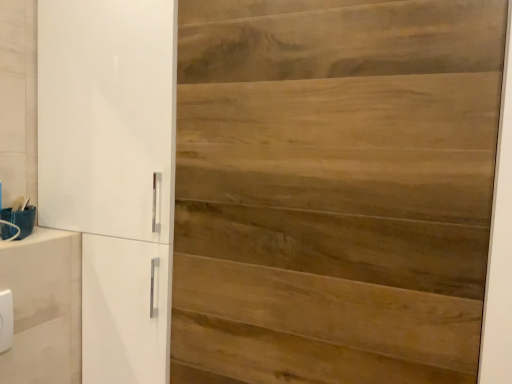
Locate an element on the screen. The height and width of the screenshot is (384, 512). wooden door at center is located at coordinates (333, 189).

What are the coordinates of `wooden door at center` in the screenshot? It's located at (333, 189).

Considering the positions of objects white plastic/light switch at lower left and white glossy cupboard at left in the image provided, who is more to the left, white plastic/light switch at lower left or white glossy cupboard at left?

Positioned to the left is white plastic/light switch at lower left.

Is white plastic/light switch at lower left positioned with its back to white glossy cupboard at left?

No, white plastic/light switch at lower left's orientation is not away from white glossy cupboard at left.

From a real-world perspective, who is located higher, white plastic/light switch at lower left or white glossy cupboard at left?

white glossy cupboard at left.

From the image's perspective, who appears lower, white glossy cupboard at left or wooden door at center?

wooden door at center is shown below in the image.

Is white glossy cupboard at left to the left of wooden door at center from the viewer's perspective?

Yes.

Which object is wider, white glossy cupboard at left or wooden door at center?

Wider between the two is white glossy cupboard at left.

Considering the positions of objects white plastic/light switch at lower left and wooden door at center in the image provided, who is behind, white plastic/light switch at lower left or wooden door at center?

white plastic/light switch at lower left.

Is point (11, 308) closer or farther from the camera than point (426, 250)?

Clearly, point (11, 308) is more distant from the camera than point (426, 250).

Identify the location of door lying in front of the white glossy cupboard at left. (333, 189).

Between wooden door at center and white glossy cupboard at left, which one has larger width?

With larger width is white glossy cupboard at left.

Looking at this image, from a real-world perspective, is wooden door at center positioned over white glossy cupboard at left based on gravity?

Yes, from a real-world perspective, wooden door at center is over white glossy cupboard at left

Is wooden door at center taller or shorter than white glossy cupboard at left?

wooden door at center is shorter than white glossy cupboard at left.

Considering the relative sizes of wooden door at center and white plastic/light switch at lower left in the image provided, is wooden door at center wider than white plastic/light switch at lower left?

No, wooden door at center is not wider than white plastic/light switch at lower left.

Does wooden door at center turn towards white plastic/light switch at lower left?

No, wooden door at center is not facing towards white plastic/light switch at lower left.

Can you tell me how much wooden door at center and white plastic/light switch at lower left differ in facing direction?

89.8 degrees.

This screenshot has width=512, height=384. In order to click on door that is on the right side of white plastic/light switch at lower left in this screenshot , I will do `click(333, 189)`.

Is white glossy cupboard at left not within white plastic/light switch at lower left?

Absolutely, white glossy cupboard at left is external to white plastic/light switch at lower left.

I want to click on light switch that appears in front of the white glossy cupboard at left, so click(6, 320).

Is white glossy cupboard at left aimed at white plastic/light switch at lower left?

Yes, white glossy cupboard at left is aimed at white plastic/light switch at lower left.

From the image's perspective, is white glossy cupboard at left on white plastic/light switch at lower left?

Yes, from the image's perspective, white glossy cupboard at left is above white plastic/light switch at lower left.

At what (x,y) coordinates should I click in order to perform the action: click on light switch directly beneath the white glossy cupboard at left (from a real-world perspective). Please return your answer as a coordinate pair (x, y). Looking at the image, I should click on (6, 320).

You are a GUI agent. You are given a task and a screenshot of the screen. Output one action in this format:
    pyautogui.click(x=<x>, y=<y>)
    Task: Click on the door that is on the right side of white glossy cupboard at left
    Image resolution: width=512 pixels, height=384 pixels.
    Given the screenshot: What is the action you would take?
    pyautogui.click(x=333, y=189)

Based on their spatial positions, is white plastic/light switch at lower left or wooden door at center closer to white glossy cupboard at left?

The object closer to white glossy cupboard at left is wooden door at center.

When comparing their distances from white plastic/light switch at lower left, does white glossy cupboard at left or wooden door at center seem closer?

The object closer to white plastic/light switch at lower left is white glossy cupboard at left.

Looking at this image, based on their spatial positions, is white glossy cupboard at left or white plastic/light switch at lower left further from wooden door at center?

Based on the image, white plastic/light switch at lower left appears to be further to wooden door at center.

When comparing their distances from white glossy cupboard at left, does wooden door at center or white plastic/light switch at lower left seem closer?

wooden door at center is closer to white glossy cupboard at left.

Looking at this image, which object lies further to the anchor point white plastic/light switch at lower left, wooden door at center or white glossy cupboard at left?

The object further to white plastic/light switch at lower left is wooden door at center.

Considering their positions, is white plastic/light switch at lower left positioned closer to wooden door at center than white glossy cupboard at left?

Based on the image, white glossy cupboard at left appears to be nearer to wooden door at center.

You are a GUI agent. You are given a task and a screenshot of the screen. Output one action in this format:
    pyautogui.click(x=<x>, y=<y>)
    Task: Click on the cupboard between white plastic/light switch at lower left and wooden door at center in the horizontal direction
    
    Given the screenshot: What is the action you would take?
    point(112,171)